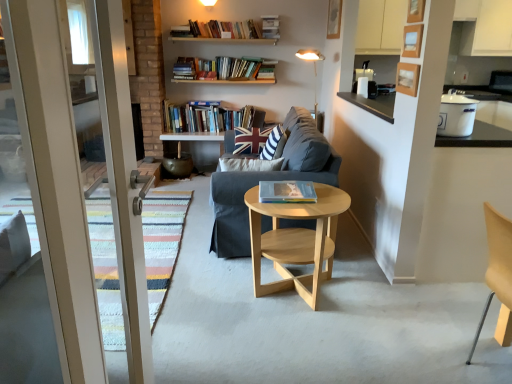
Question: Considering the relative positions of hardcover book at center, which ranks as the 1th book in bottom-to-top order, and union jack fabric pillow at center, positioned as the first pillow in back-to-front order, in the image provided, is hardcover book at center, which ranks as the 1th book in bottom-to-top order, to the left of union jack fabric pillow at center, positioned as the first pillow in back-to-front order, from the viewer's perspective?

Choices:
 (A) no
 (B) yes

Answer: (A)

Question: Could you tell me if hardcover book at center, which is the 2th book from left to right, is facing union jack fabric pillow at center, the second pillow in the front-to-back sequence?

Choices:
 (A) yes
 (B) no

Answer: (B)

Question: Can you confirm if hardcover book at center, which is the 2th book from left to right, is bigger than union jack fabric pillow at center, the second pillow in the front-to-back sequence?

Choices:
 (A) yes
 (B) no

Answer: (B)

Question: Can we say hardcover book at center, which is the 1th book from right to left, lies outside union jack fabric pillow at center, positioned as the first pillow in back-to-front order?

Choices:
 (A) no
 (B) yes

Answer: (B)

Question: Is hardcover book at center, which is the 1th book from right to left, placed right next to union jack fabric pillow at center, the second pillow in the front-to-back sequence?

Choices:
 (A) yes
 (B) no

Answer: (B)

Question: Is light wood/woodenobject at center bigger or smaller than white fabric lampshade at upper center?

Choices:
 (A) big
 (B) small

Answer: (A)

Question: From the image's perspective, is light wood/woodenobject at center positioned above or below white fabric lampshade at upper center?

Choices:
 (A) below
 (B) above

Answer: (A)

Question: Based on their positions, is light wood/woodenobject at center located to the left or right of white fabric lampshade at upper center?

Choices:
 (A) right
 (B) left

Answer: (B)

Question: In the image, is light wood/woodenobject at center positioned in front of or behind white fabric lampshade at upper center?

Choices:
 (A) front
 (B) behind

Answer: (A)

Question: From the image's perspective, relative to union jack fabric pillow at center, the second pillow in the front-to-back sequence, is dark gray fabric couch at center above or below?

Choices:
 (A) above
 (B) below

Answer: (B)

Question: From a real-world perspective, is dark gray fabric couch at center above or below union jack fabric pillow at center, positioned as the first pillow in back-to-front order?

Choices:
 (A) above
 (B) below

Answer: (B)

Question: Relative to union jack fabric pillow at center, positioned as the first pillow in back-to-front order, is dark gray fabric couch at center in front or behind?

Choices:
 (A) front
 (B) behind

Answer: (A)

Question: Considering the positions of dark gray fabric couch at center and union jack fabric pillow at center, the second pillow in the front-to-back sequence, in the image, is dark gray fabric couch at center taller or shorter than union jack fabric pillow at center, the second pillow in the front-to-back sequence,?

Choices:
 (A) tall
 (B) short

Answer: (A)

Question: From the image's perspective, is striped fabric pillow at center, which is the second pillow in back-to-front order, positioned above or below white enamel pot at upper right?

Choices:
 (A) above
 (B) below

Answer: (B)

Question: In terms of width, does striped fabric pillow at center, marked as the 1th pillow in a front-to-back arrangement, look wider or thinner when compared to white enamel pot at upper right?

Choices:
 (A) thin
 (B) wide

Answer: (A)